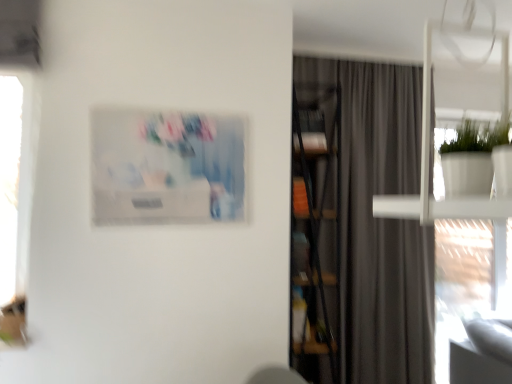
Question: Considering the relative positions of gray matte curtain at center and wooden bookcase at center in the image provided, is gray matte curtain at center to the right of wooden bookcase at center from the viewer's perspective?

Choices:
 (A) yes
 (B) no

Answer: (A)

Question: From a real-world perspective, is gray matte curtain at center on wooden bookcase at center?

Choices:
 (A) no
 (B) yes

Answer: (B)

Question: Is gray matte curtain at center bigger than wooden bookcase at center?

Choices:
 (A) yes
 (B) no

Answer: (A)

Question: Is wooden bookcase at center inside gray matte curtain at center?

Choices:
 (A) no
 (B) yes

Answer: (B)

Question: Is gray matte curtain at center turned away from wooden bookcase at center?

Choices:
 (A) no
 (B) yes

Answer: (A)

Question: Can you confirm if gray matte curtain at center is wider than wooden bookcase at center?

Choices:
 (A) yes
 (B) no

Answer: (B)

Question: Is matte plastic picture frame at upper center bigger than wooden bookcase at center?

Choices:
 (A) yes
 (B) no

Answer: (B)

Question: Considering the relative sizes of matte plastic picture frame at upper center and wooden bookcase at center in the image provided, is matte plastic picture frame at upper center taller than wooden bookcase at center?

Choices:
 (A) no
 (B) yes

Answer: (A)

Question: Is matte plastic picture frame at upper center facing towards wooden bookcase at center?

Choices:
 (A) yes
 (B) no

Answer: (B)

Question: Is matte plastic picture frame at upper center looking in the opposite direction of wooden bookcase at center?

Choices:
 (A) yes
 (B) no

Answer: (B)

Question: From the image's perspective, is matte plastic picture frame at upper center under wooden bookcase at center?

Choices:
 (A) no
 (B) yes

Answer: (A)

Question: Would you say matte plastic picture frame at upper center is outside wooden bookcase at center?

Choices:
 (A) yes
 (B) no

Answer: (A)

Question: Considering the relative sizes of wooden bookcase at center and gray matte curtain at center in the image provided, is wooden bookcase at center bigger than gray matte curtain at center?

Choices:
 (A) yes
 (B) no

Answer: (B)